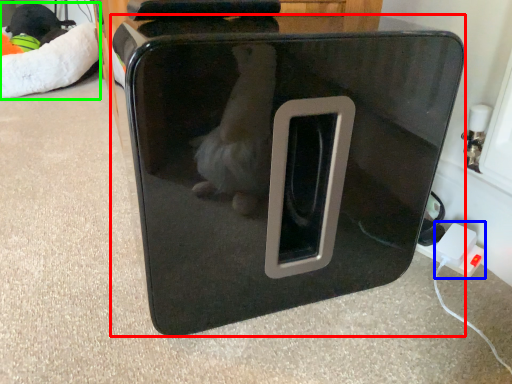
Question: Considering the real-world distances, which object is closest to home appliance (highlighted by a red box)? electric outlet (highlighted by a blue box) or bean bag chair (highlighted by a green box).

Choices:
 (A) electric outlet
 (B) bean bag chair

Answer: (A)